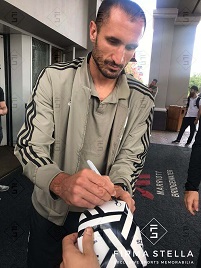
I want to click on trashcan, so point(175,113).